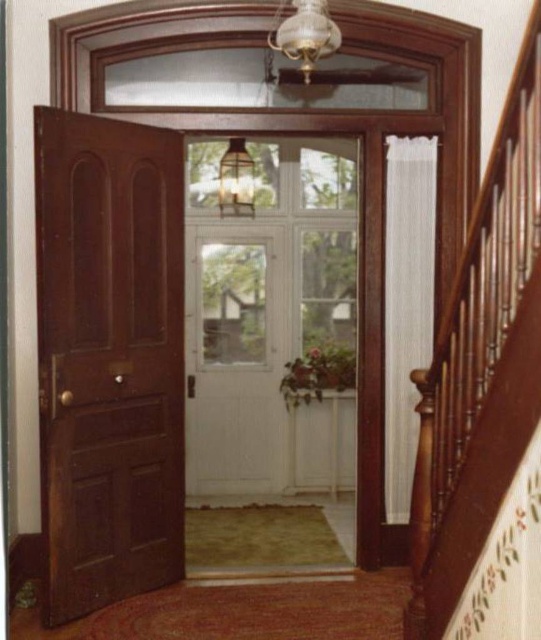
You are a delivery person carrying a large package that is 3 meters long. You need to move it through the hallway from the entrance to the staircase. Is there enough space between the white wood door at center and the wooden stair rail at right to maneuver the package?

The distance between the white wood door at center and the wooden stair rail at right is 3.18 meters. Since the package is 3 meters long, there is enough space to maneuver it through the hallway.

You are a delivery person carrying a large package that is 2 meters wide. You need to move through the hallway between the shiny dark wood door at left and the white wood door at center. Can you fit through the space between them?

The shiny dark wood door at left and white wood door at center are 2.04 meters apart from each other. Since your package is 2 meters wide, it will just barely fit through the space between them with a small amount of clearance.

You are a delivery person trying to deliver a package to apartment 3B. You see two doors in the hallway, a shiny dark wood door at left and a white wood door at center. Which door is more likely to be the correct one for apartment 3B based on their sizes?

The shiny dark wood door at left has a larger size compared to the white wood door at center, so it is more likely to be the correct door for apartment 3B since larger doors are often used for main entrances or specific units.